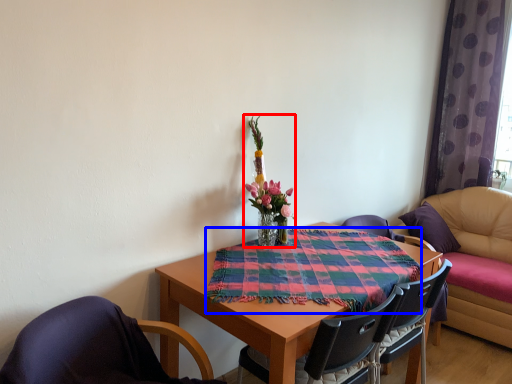
Question: Which object is closer to the camera taking this photo, floral arrangement (highlighted by a red box) or cloth (highlighted by a blue box)?

Choices:
 (A) floral arrangement
 (B) cloth

Answer: (B)